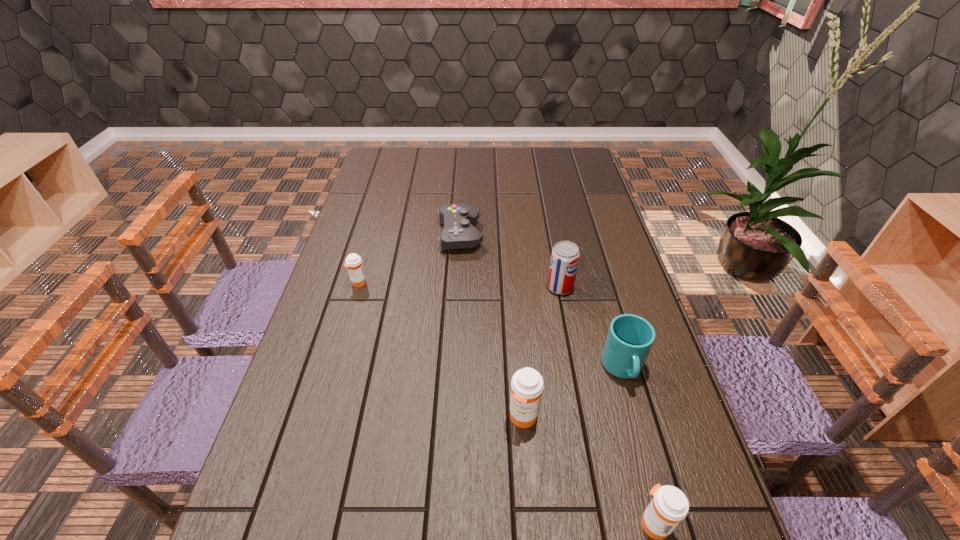
This screenshot has height=540, width=960. In order to click on the second shortest object in this screenshot , I will do `click(353, 261)`.

You are a GUI agent. You are given a task and a screenshot of the screen. Output one action in this format:
    pyautogui.click(x=<x>, y=<y>)
    Task: Click on the shortest medicine
    This screenshot has height=540, width=960.
    Given the screenshot: What is the action you would take?
    pyautogui.click(x=353, y=261)

Identify the location of the second nearest medicine. Image resolution: width=960 pixels, height=540 pixels. (527, 384).

Locate an element on the screen. The width and height of the screenshot is (960, 540). the second medicine from right to left is located at coordinates [x=527, y=384].

Image resolution: width=960 pixels, height=540 pixels. What are the coordinates of `the third object from right to left` in the screenshot? It's located at (565, 255).

Where is `the fifth object from right to left`? This screenshot has width=960, height=540. the fifth object from right to left is located at coordinates (458, 219).

Locate an element on the screen. the shortest object is located at coordinates (458, 219).

What are the coordinates of `cup` in the screenshot? It's located at (630, 337).

You are a GUI agent. You are given a task and a screenshot of the screen. Output one action in this format:
    pyautogui.click(x=<x>, y=<y>)
    Task: Click on the vacant space situated 0.050m on the right of the leftmost medicine
    
    Given the screenshot: What is the action you would take?
    pyautogui.click(x=383, y=282)

Identify the location of free space located 0.310m on the right of the fourth object from right to left. This screenshot has width=960, height=540. (677, 417).